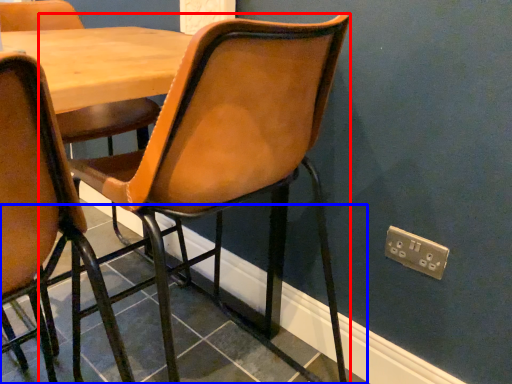
Question: Among these objects, which one is farthest to the camera, chair (highlighted by a red box) or tile (highlighted by a blue box)?

Choices:
 (A) chair
 (B) tile

Answer: (B)